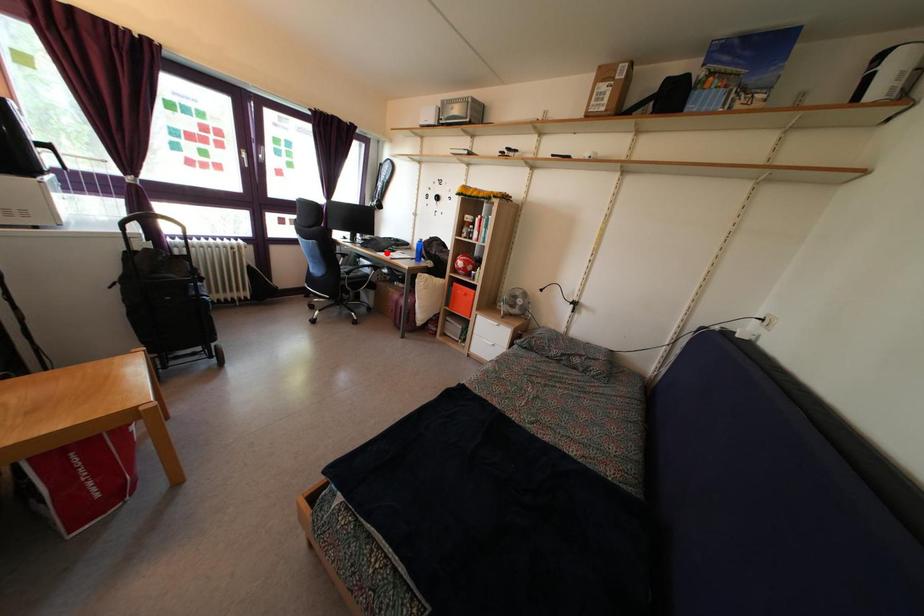
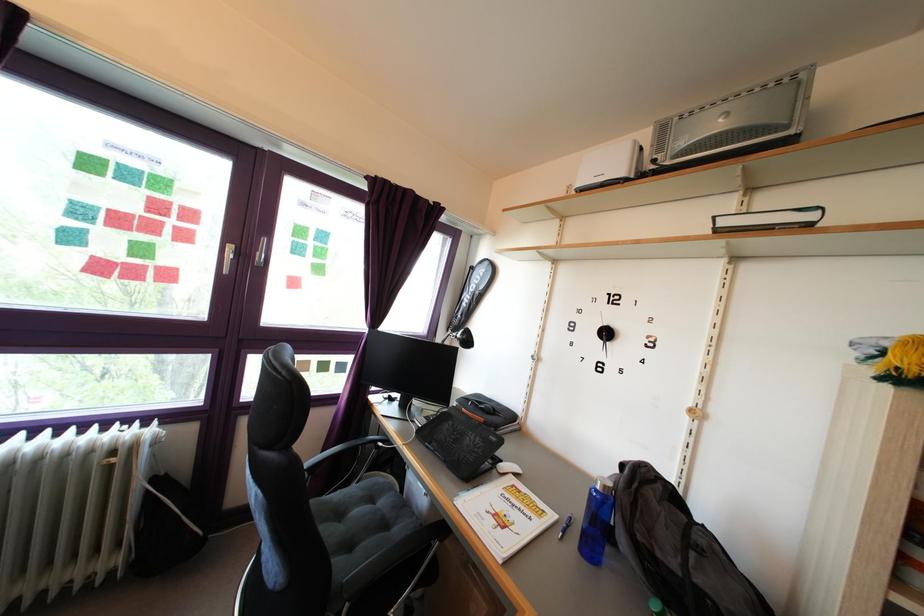
Where in the second image is the point corresponding to the highlighted location from the first image?

(472, 447)